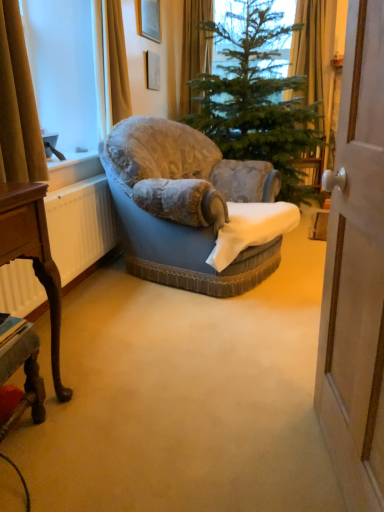
The height and width of the screenshot is (512, 384). Find the location of `free space between wooden desk at lower left, which is the second desk from top to bottom, and velvet blue armchair at center`. free space between wooden desk at lower left, which is the second desk from top to bottom, and velvet blue armchair at center is located at coordinates (127, 345).